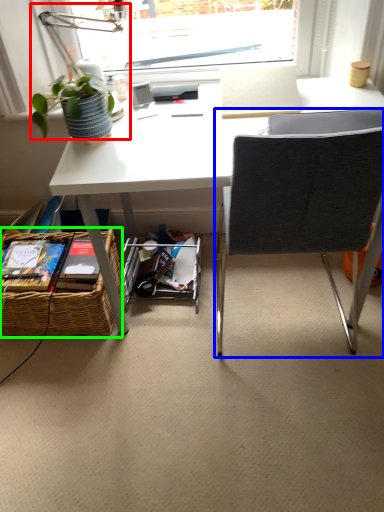
Question: Which is nearer to the table lamp (highlighted by a red box)? chair (highlighted by a blue box) or picnic basket (highlighted by a green box).

Choices:
 (A) chair
 (B) picnic basket

Answer: (B)